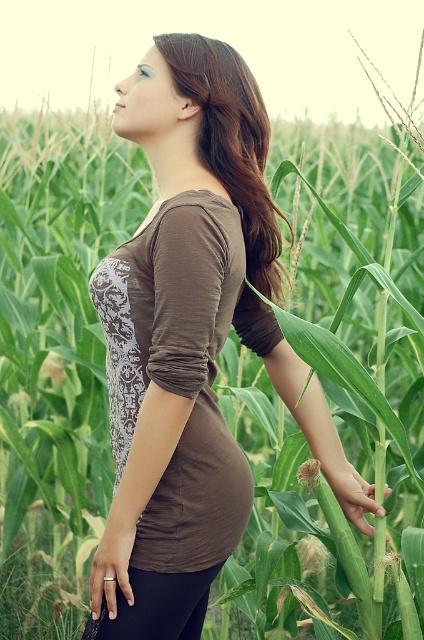
You are a photographer taking a picture of the woman in the field. You notice the brown matte shirt at center and the brown matte hair at center. Which object should you focus on first if you want to ensure both are in sharp focus?

Since the brown matte shirt at center is closer to the viewer than the brown matte hair at center, you should focus on the brown matte shirt at center first. This ensures that the closer object is in focus, and the farther one may also be within the depth of field.

You are standing in the cornfield and want to take a photo of the point at coordinates point (x=105, y=561). Your camera has a focal length of 50mm and a sensor size of 24mm x 36mm. If the point is 1.63 meters away from the camera, what is the minimum distance you should be from the point to ensure it fits entirely within the frame?

The point (x=105, y=561) is 1.63 meters away from the camera. To ensure it fits within the frame, you should be at least 1.63 meters away from the point (x=105, y=561).

What is located at the coordinates point (x=192, y=342) in the image?

The brown matte shirt at center is located at point (x=192, y=342).